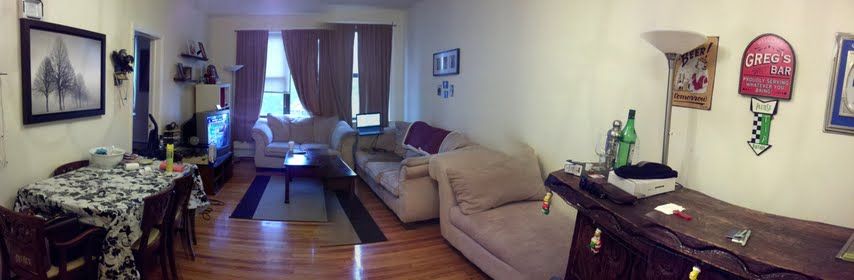
This screenshot has height=280, width=854. Find the location of `rug`. rug is located at coordinates (295, 196).